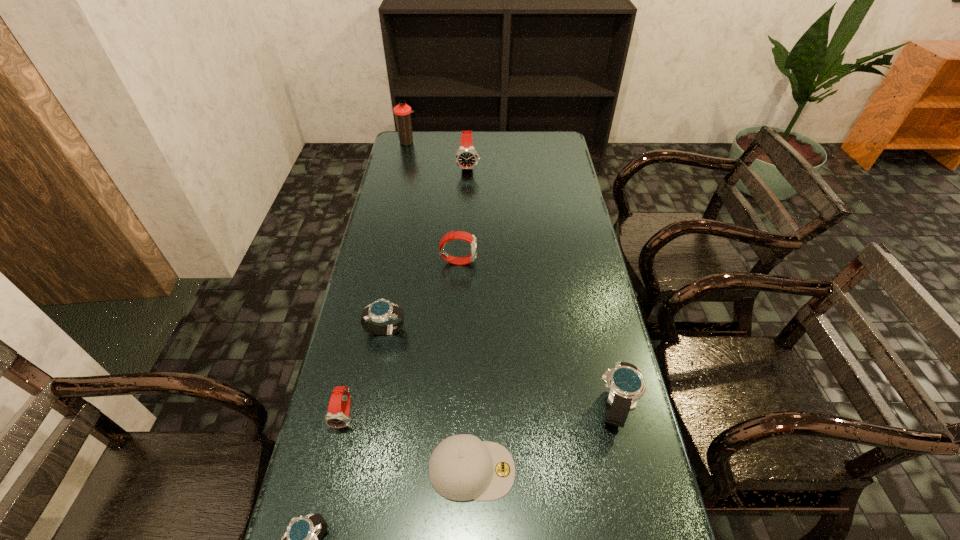
Select which red watch appears as the third closest to the fourth farthest object. Please provide its 2D coordinates. Your answer should be formatted as a tuple, i.e. [(x, y)], where the tuple contains the x and y coordinates of a point satisfying the conditions above.

[(466, 158)]

Where is `red watch that can be found as the closest to the second farthest red watch`? This screenshot has width=960, height=540. red watch that can be found as the closest to the second farthest red watch is located at coordinates click(466, 158).

Image resolution: width=960 pixels, height=540 pixels. In order to click on the third closest silver watch to the farthest object in this screenshot , I will do `click(302, 539)`.

Select which silver watch appears as the second closest to the second biggest silver watch. Please provide its 2D coordinates. Your answer should be formatted as a tuple, i.e. [(x, y)], where the tuple contains the x and y coordinates of a point satisfying the conditions above.

[(626, 386)]

The image size is (960, 540). In order to click on free spot that satisfies the following two spatial constraints: 1. on the face of the rightmost watch; 2. on the right side of the second farthest red watch in this screenshot , I will do `click(451, 407)`.